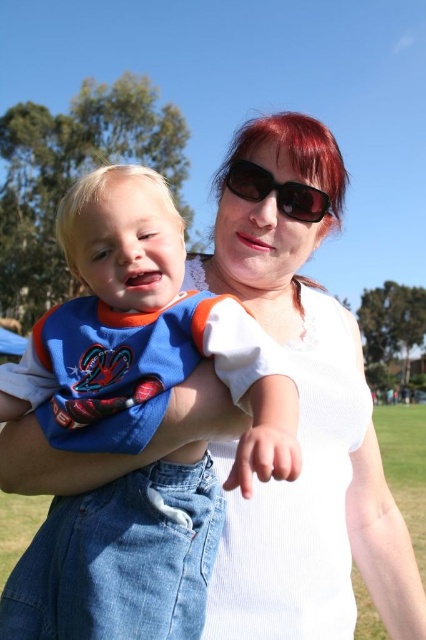
From the picture: Does matte blue jersey at center have a greater height compared to sunglasses at center?

Yes, matte blue jersey at center is taller than sunglasses at center.

I want to click on matte blue jersey at center, so click(143, 336).

The height and width of the screenshot is (640, 426). I want to click on matte blue jersey at center, so click(x=143, y=336).